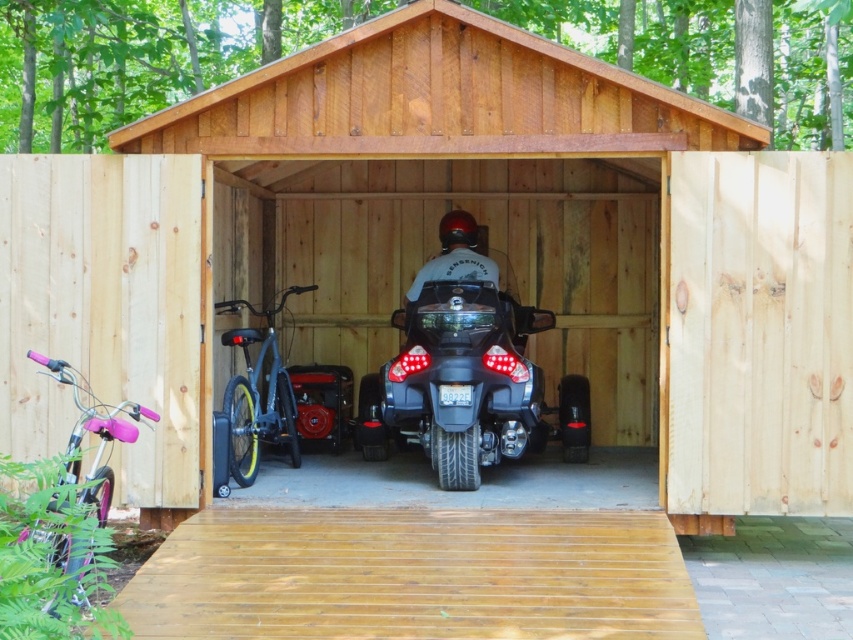
Is pink metallic bicycle at lower left closer to the viewer compared to matte black bicycle at center?

Yes, pink metallic bicycle at lower left is in front of matte black bicycle at center.

Is pink metallic bicycle at lower left shorter than matte black bicycle at center?

Yes, pink metallic bicycle at lower left is shorter than matte black bicycle at center.

What are the coordinates of `pink metallic bicycle at lower left` in the screenshot? It's located at (93, 433).

Who is more forward, (489, 456) or (454, 273)?

Point (489, 456) is in front.

Which is above, black matte trike at center or matte black motorcycle at center?

matte black motorcycle at center is higher up.

The image size is (853, 640). What are the coordinates of `black matte trike at center` in the screenshot? It's located at (465, 380).

Is point (755, 209) in front of point (78, 451)?

No, (755, 209) is behind (78, 451).

Where is `natural wood garage door at center`? Image resolution: width=853 pixels, height=640 pixels. natural wood garage door at center is located at coordinates (756, 337).